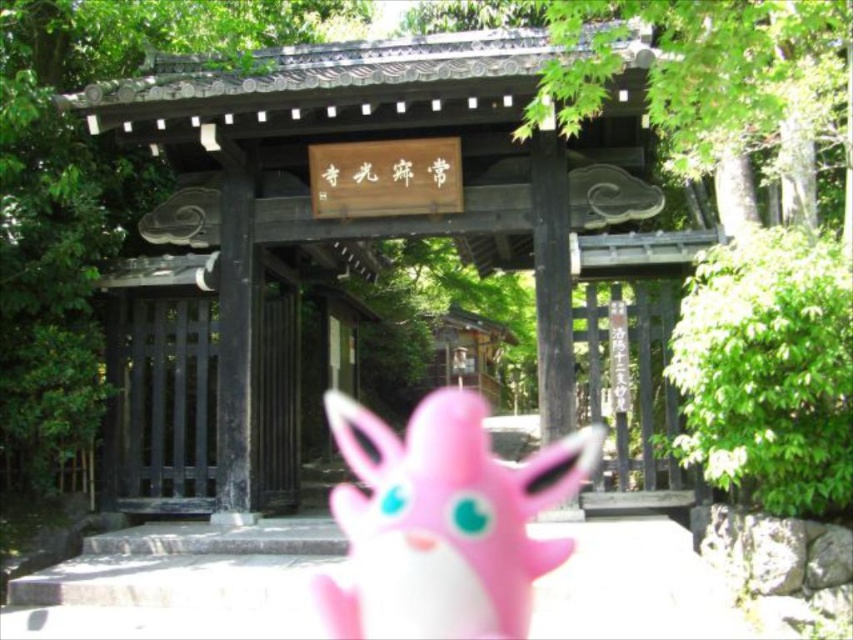
Question: Can you confirm if pink rubber toy at center is positioned below black wooden gate at center?

Choices:
 (A) yes
 (B) no

Answer: (A)

Question: Which point is closer to the camera taking this photo?

Choices:
 (A) (447, 595)
 (B) (254, 461)

Answer: (A)

Question: Which of the following is the farthest from the observer?

Choices:
 (A) (289, 365)
 (B) (407, 580)

Answer: (A)

Question: Which point is farther from the camera taking this photo?

Choices:
 (A) (515, 520)
 (B) (271, 422)

Answer: (B)

Question: Is pink rubber toy at center above black wooden gate at center?

Choices:
 (A) no
 (B) yes

Answer: (A)

Question: Is pink rubber toy at center bigger than black wooden gate at center?

Choices:
 (A) yes
 (B) no

Answer: (A)